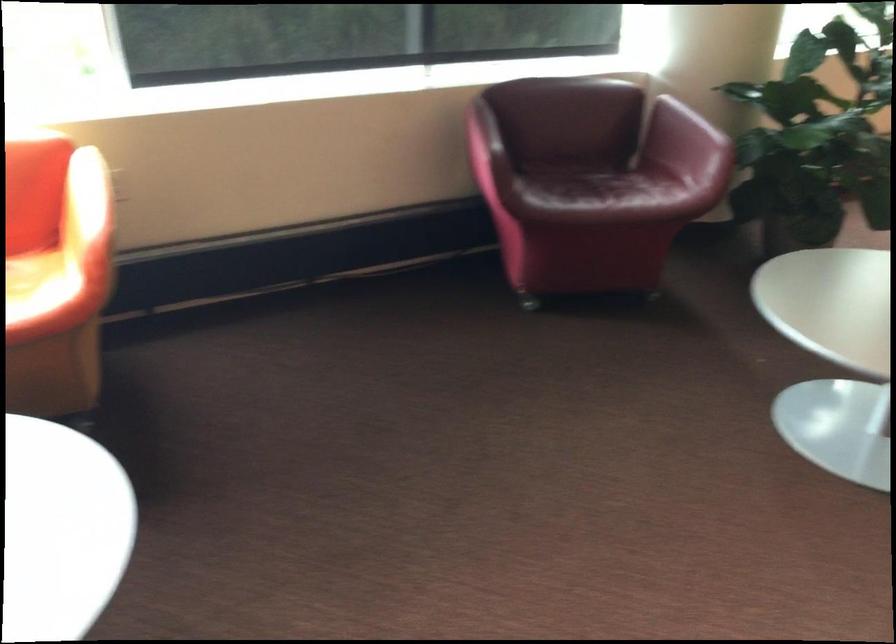
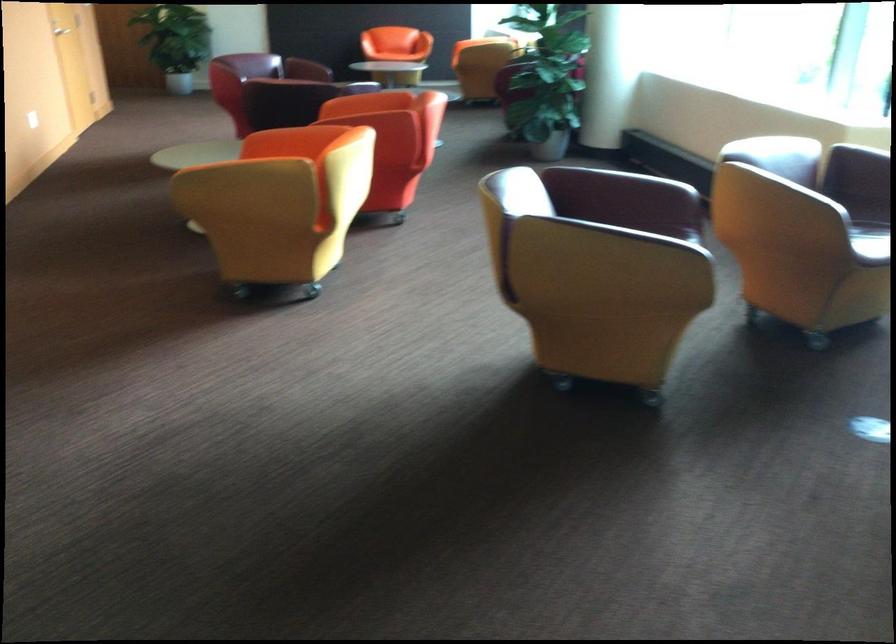
Question: I am providing you with two images of the same scene from different viewpoints. Please identify which objects are invisible in image2.

Choices:
 (A) red chair armrest
 (B) silver pot handle
 (C) red chair sitting surface
 (D) yellow chair armrest

Answer: (C)